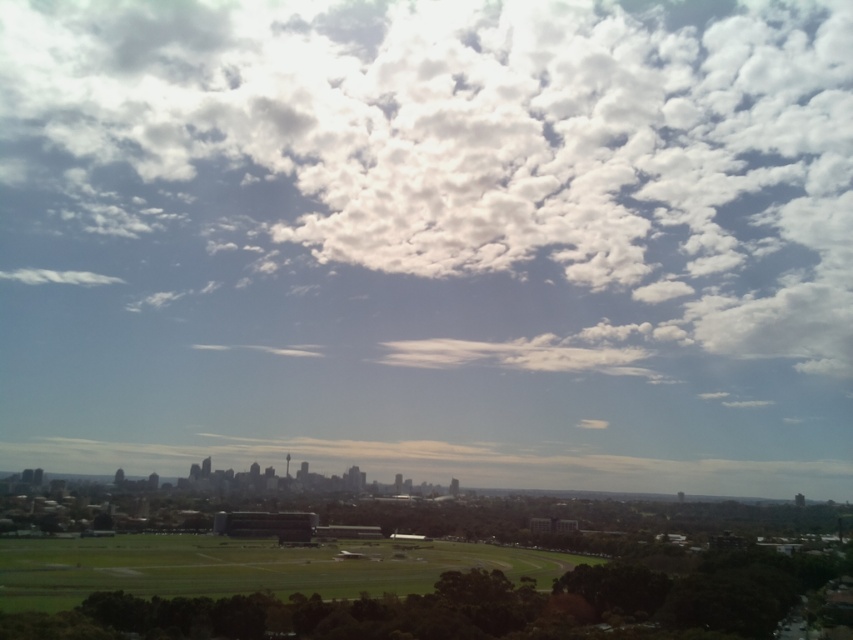
Looking at this image, you are a drone operator preparing to fly a drone that has a maximum flight range of 600 meters. You want to capture a photo of the white fluffy cloud at upper center from your current position. Can your drone reach the cloud?

The white fluffy cloud at upper center is 636.59 meters away from the camera. Since the drone can only fly up to 600 meters, it cannot reach the cloud.

You are an architect designing a new skyscraper that needs to avoid blocking the view of the white fluffy cloud at upper center. The city requires that the top of your building must be at least 10 meters below the base of this cloud. If the cloud is located at coordinates 0.225, 0.570 in the image, how high can your building be constructed?

The white fluffy cloud at upper center is located at point (485, 144). To comply with the city regulations, the top of the building must be at least 10 meters below the base of the cloud. Therefore, the maximum height for the new skyscraper would be the elevation of the cloud base minus 10 meters.